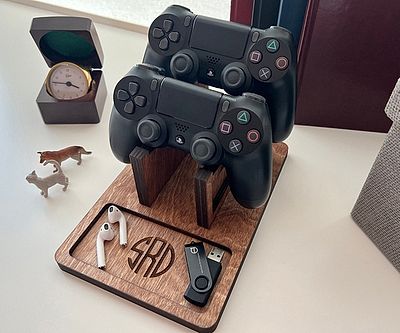
At what (x,y) coordinates should I click in order to perform the action: click on white cat ornament. Please return your answer as a coordinate pair (x, y). The height and width of the screenshot is (333, 400). Looking at the image, I should click on 58,181.